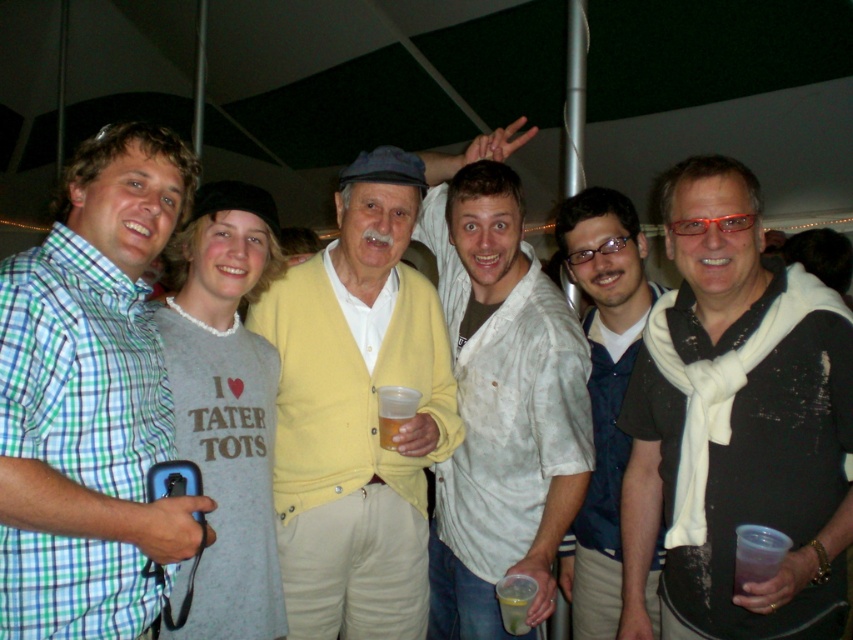
Does white matte scarf at center have a lesser height compared to translucent plastic cup at center?

No, white matte scarf at center is not shorter than translucent plastic cup at center.

Is point (606, 225) more distant than point (381, 445)?

Yes, point (606, 225) is farther from viewer.

Is point (579, 198) in front of point (387, 417)?

That is False.

The image size is (853, 640). I want to click on white matte scarf at center, so click(x=602, y=392).

Can you confirm if black textured scarf at right is smaller than yellow cardigan at center?

Correct, black textured scarf at right occupies less space than yellow cardigan at center.

You are a GUI agent. You are given a task and a screenshot of the screen. Output one action in this format:
    pyautogui.click(x=<x>, y=<y>)
    Task: Click on the black textured scarf at right
    The image size is (853, 640).
    Given the screenshot: What is the action you would take?
    pos(735,424)

At what (x,y) coordinates should I click in order to perform the action: click on black textured scarf at right. Please return your answer as a coordinate pair (x, y). Looking at the image, I should click on (735, 424).

The height and width of the screenshot is (640, 853). I want to click on black textured scarf at right, so click(x=735, y=424).

Where is `black textured scarf at right`? The image size is (853, 640). black textured scarf at right is located at coordinates (735, 424).

Between black textured scarf at right and translucent plastic cup at center, which one appears on the right side from the viewer's perspective?

Positioned to the right is black textured scarf at right.

The height and width of the screenshot is (640, 853). What are the coordinates of `black textured scarf at right` in the screenshot? It's located at [735, 424].